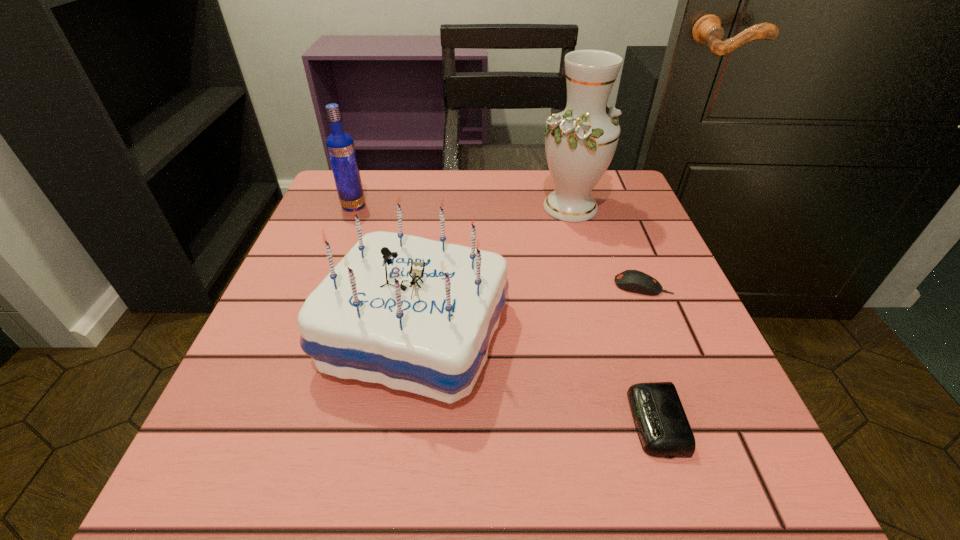
The image size is (960, 540). In order to click on vacant space positioned on the display of the alarm clock in this screenshot , I will do `click(367, 421)`.

Find the location of a particular element. The height and width of the screenshot is (540, 960). free region located on the display of the alarm clock is located at coordinates (490, 421).

The height and width of the screenshot is (540, 960). Find the location of `vase situated at the far edge`. vase situated at the far edge is located at coordinates (580, 142).

I want to click on vodka that is at the far edge, so click(340, 146).

The image size is (960, 540). Identify the location of object at the near edge. (663, 428).

Where is `vodka that is at the left edge`? This screenshot has height=540, width=960. vodka that is at the left edge is located at coordinates (340, 146).

What are the coordinates of `birthday cake that is at the left edge` in the screenshot? It's located at (414, 314).

You are a GUI agent. You are given a task and a screenshot of the screen. Output one action in this format:
    pyautogui.click(x=<x>, y=<y>)
    Task: Click on the vase that is at the right edge
    
    Given the screenshot: What is the action you would take?
    coord(580,142)

Image resolution: width=960 pixels, height=540 pixels. What are the coordinates of `computer mouse that is at the right edge` in the screenshot? It's located at (635, 281).

In order to click on alarm clock that is at the right edge in this screenshot , I will do `click(663, 428)`.